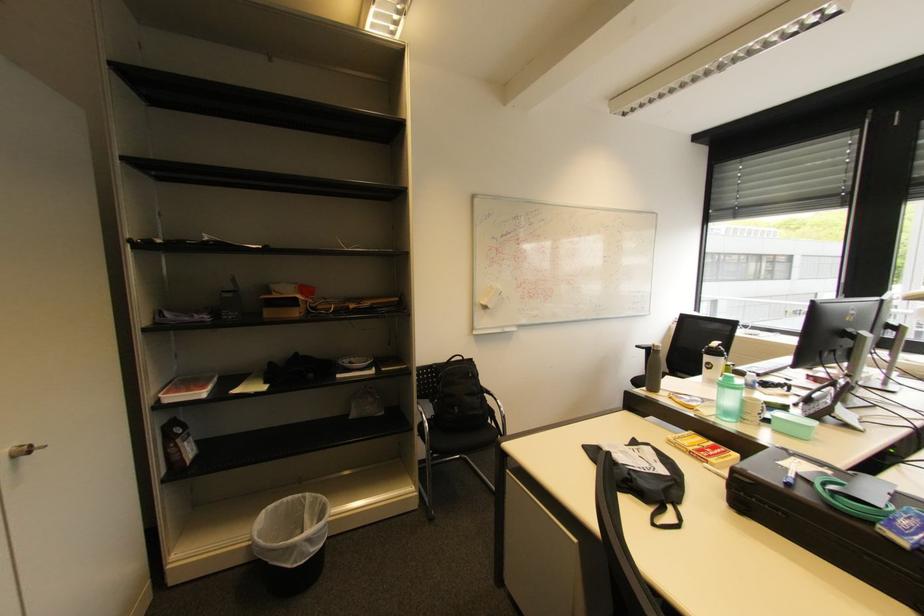
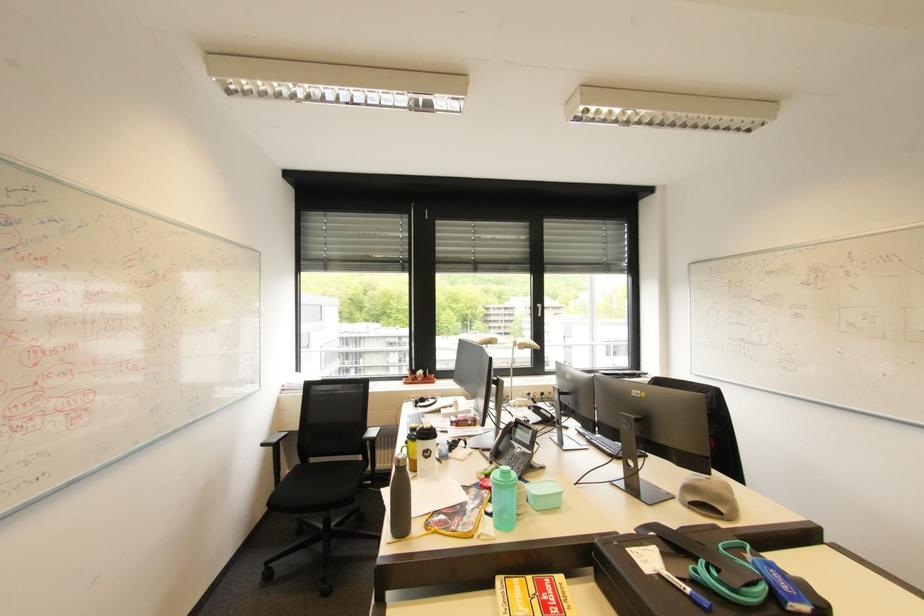
Where in the second image is the point corresponding to the point at 883,531 from the first image?

(795, 610)